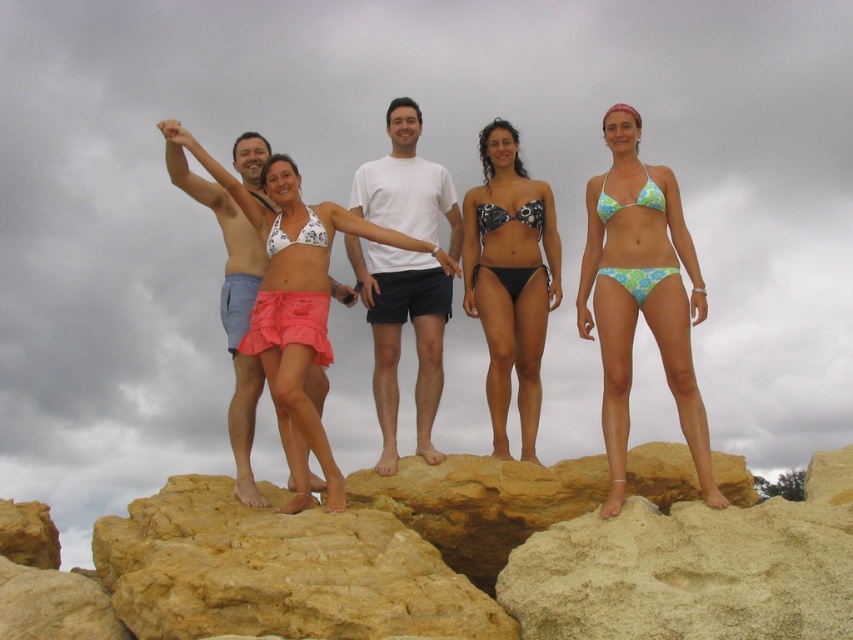
Question: Can you confirm if yellow sandstone rock at center is positioned to the right of black printed bikini at center?

Choices:
 (A) yes
 (B) no

Answer: (B)

Question: From the image, what is the correct spatial relationship of printed fabric bikini at center in relation to light blue denim shorts at left?

Choices:
 (A) above
 (B) below

Answer: (A)

Question: Does light blue denim shorts at left appear on the right side of green floral bikini at right?

Choices:
 (A) no
 (B) yes

Answer: (A)

Question: Which object is closer to the camera taking this photo?

Choices:
 (A) white matte t-shirt at center
 (B) printed fabric bikini at center
 (C) white printed bikini at center
 (D) yellow sandstone rock at center

Answer: (D)

Question: Estimate the real-world distances between objects in this image. Which object is closer to the printed fabric bikini at center?

Choices:
 (A) black printed bikini at center
 (B) white matte t-shirt at center

Answer: (A)

Question: Which of the following is the closest to the observer?

Choices:
 (A) (311, 224)
 (B) (517, 212)

Answer: (A)